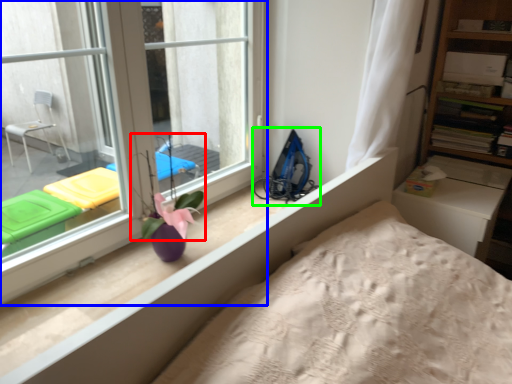
Question: Which is farther away from plant (highlighted by a red box)? window (highlighted by a blue box) or equipment (highlighted by a green box)?

Choices:
 (A) window
 (B) equipment

Answer: (B)